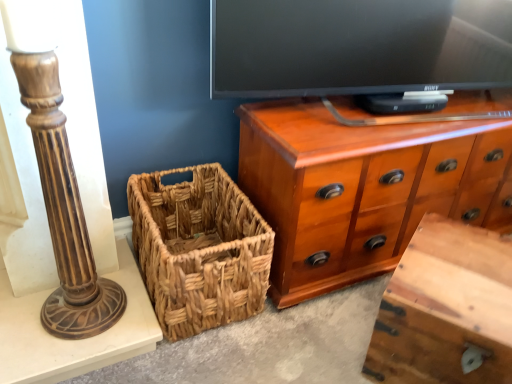
Question: From the image's perspective, is brown polished wood candlestick at left beneath wooden vanity at lower right?

Choices:
 (A) no
 (B) yes

Answer: (A)

Question: Could you tell me if brown polished wood candlestick at left is turned towards wooden vanity at lower right?

Choices:
 (A) yes
 (B) no

Answer: (B)

Question: Can you confirm if brown polished wood candlestick at left is positioned to the left of wooden vanity at lower right?

Choices:
 (A) yes
 (B) no

Answer: (A)

Question: Can you confirm if brown polished wood candlestick at left is taller than wooden vanity at lower right?

Choices:
 (A) no
 (B) yes

Answer: (B)

Question: Is brown polished wood candlestick at left behind wooden vanity at lower right?

Choices:
 (A) yes
 (B) no

Answer: (B)

Question: Is brown polished wood candlestick at left surrounding wooden vanity at lower right?

Choices:
 (A) yes
 (B) no

Answer: (B)

Question: Considering the relative positions of wooden vanity at lower right and shiny brown wood chest of drawers at upper right in the image provided, is wooden vanity at lower right in front of shiny brown wood chest of drawers at upper right?

Choices:
 (A) yes
 (B) no

Answer: (A)

Question: Is wooden vanity at lower right further to camera compared to shiny brown wood chest of drawers at upper right?

Choices:
 (A) yes
 (B) no

Answer: (B)

Question: Is wooden vanity at lower right bigger than shiny brown wood chest of drawers at upper right?

Choices:
 (A) yes
 (B) no

Answer: (B)

Question: Considering the relative sizes of wooden vanity at lower right and shiny brown wood chest of drawers at upper right in the image provided, is wooden vanity at lower right shorter than shiny brown wood chest of drawers at upper right?

Choices:
 (A) yes
 (B) no

Answer: (A)

Question: From a real-world perspective, is wooden vanity at lower right on shiny brown wood chest of drawers at upper right?

Choices:
 (A) yes
 (B) no

Answer: (B)

Question: Is wooden vanity at lower right not close to shiny brown wood chest of drawers at upper right?

Choices:
 (A) no
 (B) yes

Answer: (A)

Question: Can we say wooden vanity at lower right lies outside woven brown picnic basket at lower left?

Choices:
 (A) no
 (B) yes

Answer: (B)